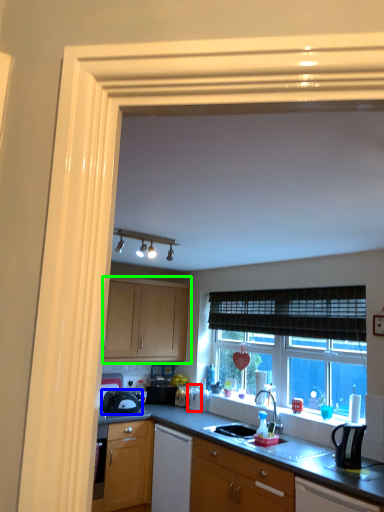
Question: Estimate the real-world distances between objects in this image. Which object is closer to appliance (highlighted by a red box), kitchen appliance (highlighted by a blue box) or cabinetry (highlighted by a green box)?

Choices:
 (A) kitchen appliance
 (B) cabinetry

Answer: (A)